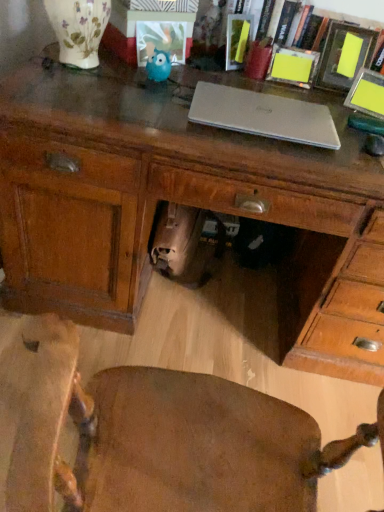
In order to click on wooden chair at center in this screenshot , I will do `click(151, 435)`.

Identify the location of matte wooden picture frame at upper right, which is counted as the third picture frame, starting from the left. (340, 53).

What are the coordinates of `yellow paper picture frame at upper right, placed as the 3th picture frame when sorted from right to left` in the screenshot? It's located at (293, 66).

This screenshot has width=384, height=512. I want to click on matte plastic picture frame at center, the first picture frame positioned from the left, so (x=161, y=40).

Locate an element on the screen. silver metallic laptop at center is located at coordinates (263, 115).

Between matte yellow book at upper center, marked as the first book in a left-to-right arrangement, and yellow paper picture frame at upper right, the second picture frame in the left-to-right sequence, which one has less height?

With less height is yellow paper picture frame at upper right, the second picture frame in the left-to-right sequence.

From the image's perspective, which one is positioned lower, matte yellow book at upper center, acting as the second book starting from the right, or yellow paper picture frame at upper right, placed as the 3th picture frame when sorted from right to left?

yellow paper picture frame at upper right, placed as the 3th picture frame when sorted from right to left, is shown below in the image.

Is matte yellow book at upper center, acting as the second book starting from the right, far away from yellow paper picture frame at upper right, the second picture frame in the left-to-right sequence?

No, there isn't a large distance between matte yellow book at upper center, acting as the second book starting from the right, and yellow paper picture frame at upper right, the second picture frame in the left-to-right sequence.

Could you tell me if blue fuzzy owl at center is facing yellow paper picture frame at upper right, placed as the 3th picture frame when sorted from right to left?

No, blue fuzzy owl at center is not oriented towards yellow paper picture frame at upper right, placed as the 3th picture frame when sorted from right to left.

Can you tell me how much blue fuzzy owl at center and yellow paper picture frame at upper right, the second picture frame in the left-to-right sequence, differ in facing direction?

The facing directions of blue fuzzy owl at center and yellow paper picture frame at upper right, the second picture frame in the left-to-right sequence, are 5.79 degrees apart.

Is blue fuzzy owl at center at the right side of yellow paper picture frame at upper right, the second picture frame in the left-to-right sequence?

No, blue fuzzy owl at center is not to the right of yellow paper picture frame at upper right, the second picture frame in the left-to-right sequence.

From a real-world perspective, is blue fuzzy owl at center below yellow paper picture frame at upper right, the second picture frame in the left-to-right sequence?

Yes, from a real-world perspective, blue fuzzy owl at center is below yellow paper picture frame at upper right, the second picture frame in the left-to-right sequence.

Is yellow paper picture frame at upper right, placed as the 3th picture frame when sorted from right to left, positioned before wooden desk at center?

That is False.

From the image's perspective, is yellow paper picture frame at upper right, placed as the 3th picture frame when sorted from right to left, beneath wooden desk at center?

Incorrect, from the image's perspective, yellow paper picture frame at upper right, placed as the 3th picture frame when sorted from right to left, is higher than wooden desk at center.

What's the angular difference between yellow paper picture frame at upper right, placed as the 3th picture frame when sorted from right to left, and wooden desk at center's facing directions?

yellow paper picture frame at upper right, placed as the 3th picture frame when sorted from right to left, and wooden desk at center are facing 0.771 degrees away from each other.

Is silver metallic laptop at center smaller than matte yellow paper at upper right, acting as the 2th book starting from the left?

Correct, silver metallic laptop at center occupies less space than matte yellow paper at upper right, acting as the 2th book starting from the left.

Is point (268, 121) in front of point (265, 34)?

That is True.

Which of these two, silver metallic laptop at center or matte yellow paper at upper right, acting as the first book starting from the right, stands shorter?

silver metallic laptop at center is shorter.

Is silver metallic laptop at center looking in the opposite direction of matte yellow paper at upper right, acting as the first book starting from the right?

Yes.

Consider the image. From the image's perspective, is wooden chair at center beneath yellow paper picture frame at upper right, which ranks as the 1th picture frame in right-to-left order?

Yes, from the image's perspective, wooden chair at center is below yellow paper picture frame at upper right, which ranks as the 1th picture frame in right-to-left order.

Does wooden chair at center turn towards yellow paper picture frame at upper right, which ranks as the 1th picture frame in right-to-left order?

Yes, wooden chair at center is facing yellow paper picture frame at upper right, which ranks as the 1th picture frame in right-to-left order.

Is wooden chair at center shorter than yellow paper picture frame at upper right, which ranks as the 4th picture frame in left-to-right order?

Incorrect, the height of wooden chair at center does not fall short of that of yellow paper picture frame at upper right, which ranks as the 4th picture frame in left-to-right order.

Could you measure the distance between matte wooden picture frame at upper right, which is counted as the third picture frame, starting from the left, and yellow paper picture frame at upper right, which ranks as the 4th picture frame in left-to-right order?

matte wooden picture frame at upper right, which is counted as the third picture frame, starting from the left, and yellow paper picture frame at upper right, which ranks as the 4th picture frame in left-to-right order, are 4.30 inches apart from each other.

From the image's perspective, between matte wooden picture frame at upper right, which is the second picture frame in right-to-left order, and yellow paper picture frame at upper right, which ranks as the 1th picture frame in right-to-left order, who is located below?

yellow paper picture frame at upper right, which ranks as the 1th picture frame in right-to-left order.

Would you say matte wooden picture frame at upper right, which is the second picture frame in right-to-left order, is a long distance from yellow paper picture frame at upper right, which ranks as the 4th picture frame in left-to-right order?

No.

Does matte wooden picture frame at upper right, which is counted as the third picture frame, starting from the left, appear on the left side of yellow paper picture frame at upper right, which ranks as the 1th picture frame in right-to-left order?

Correct, you'll find matte wooden picture frame at upper right, which is counted as the third picture frame, starting from the left, to the left of yellow paper picture frame at upper right, which ranks as the 1th picture frame in right-to-left order.

Looking at this image, how much distance is there between matte plastic picture frame at center, the first picture frame positioned from the left, and blue fuzzy owl at center?

matte plastic picture frame at center, the first picture frame positioned from the left, is 4.94 centimeters from blue fuzzy owl at center.

Is matte plastic picture frame at center, marked as the fourth picture frame in a right-to-left arrangement, at the right side of blue fuzzy owl at center?

Yes.

In terms of size, does matte plastic picture frame at center, the first picture frame positioned from the left, appear bigger or smaller than blue fuzzy owl at center?

Clearly, matte plastic picture frame at center, the first picture frame positioned from the left, is larger in size than blue fuzzy owl at center.

Where is `picture frame behind the matte yellow book at upper center, marked as the first book in a left-to-right arrangement`? picture frame behind the matte yellow book at upper center, marked as the first book in a left-to-right arrangement is located at coordinates (293, 66).

Where is `toy that is under the yellow paper picture frame at upper right, placed as the 3th picture frame when sorted from right to left (from a real-world perspective)`? The width and height of the screenshot is (384, 512). toy that is under the yellow paper picture frame at upper right, placed as the 3th picture frame when sorted from right to left (from a real-world perspective) is located at coordinates (158, 66).

When comparing their distances from matte yellow paper at upper right, acting as the first book starting from the right, does wooden chair at center or matte wooden picture frame at upper right, which is counted as the third picture frame, starting from the left, seem closer?

matte wooden picture frame at upper right, which is counted as the third picture frame, starting from the left, lies closer to matte yellow paper at upper right, acting as the first book starting from the right, than the other object.

From the image, which object appears to be farther from wooden chair at center, matte plastic picture frame at center, marked as the fourth picture frame in a right-to-left arrangement, or matte wooden picture frame at upper right, which is the second picture frame in right-to-left order?

Based on the image, matte wooden picture frame at upper right, which is the second picture frame in right-to-left order, appears to be further to wooden chair at center.

When comparing their distances from matte wooden picture frame at upper right, which is the second picture frame in right-to-left order, does silver metallic laptop at center or matte plastic picture frame at center, the first picture frame positioned from the left, seem further?

The object further to matte wooden picture frame at upper right, which is the second picture frame in right-to-left order, is matte plastic picture frame at center, the first picture frame positioned from the left.

From the image, which object appears to be nearer to matte yellow book at upper center, marked as the first book in a left-to-right arrangement, matte yellow paper at upper right, acting as the first book starting from the right, or matte wooden picture frame at upper right, which is counted as the third picture frame, starting from the left?

matte yellow paper at upper right, acting as the first book starting from the right.

Considering their positions, is matte wooden picture frame at upper right, which is counted as the third picture frame, starting from the left, positioned further to matte yellow paper at upper right, acting as the first book starting from the right, than yellow paper picture frame at upper right, placed as the 3th picture frame when sorted from right to left?

matte wooden picture frame at upper right, which is counted as the third picture frame, starting from the left, is positioned further to the anchor matte yellow paper at upper right, acting as the first book starting from the right.

Estimate the real-world distances between objects in this image. Which object is closer to matte plastic picture frame at center, marked as the fourth picture frame in a right-to-left arrangement, matte wooden picture frame at upper right, which is the second picture frame in right-to-left order, or wooden chair at center?

Based on the image, matte wooden picture frame at upper right, which is the second picture frame in right-to-left order, appears to be nearer to matte plastic picture frame at center, marked as the fourth picture frame in a right-to-left arrangement.

Estimate the real-world distances between objects in this image. Which object is further from blue fuzzy owl at center, wooden chair at center or matte yellow paper at upper right, acting as the 2th book starting from the left?

Among the two, wooden chair at center is located further to blue fuzzy owl at center.

Estimate the real-world distances between objects in this image. Which object is further from matte plastic picture frame at center, the first picture frame positioned from the left, matte yellow paper at upper right, acting as the 2th book starting from the left, or wooden desk at center?

wooden desk at center lies further to matte plastic picture frame at center, the first picture frame positioned from the left, than the other object.

Where is `picture frame between blue fuzzy owl at center and wooden chair at center in the up-down direction`? picture frame between blue fuzzy owl at center and wooden chair at center in the up-down direction is located at coordinates (367, 94).

Where is `picture frame between blue fuzzy owl at center and yellow paper picture frame at upper right, placed as the 3th picture frame when sorted from right to left, in the horizontal direction`? The height and width of the screenshot is (512, 384). picture frame between blue fuzzy owl at center and yellow paper picture frame at upper right, placed as the 3th picture frame when sorted from right to left, in the horizontal direction is located at coordinates (161, 40).

This screenshot has width=384, height=512. In order to click on desk between matte yellow paper at upper right, acting as the first book starting from the right, and wooden chair at center, in the vertical direction in this screenshot , I will do `click(183, 203)`.

Identify the location of toy between matte yellow book at upper center, marked as the first book in a left-to-right arrangement, and silver metallic laptop at center from top to bottom. (158, 66).